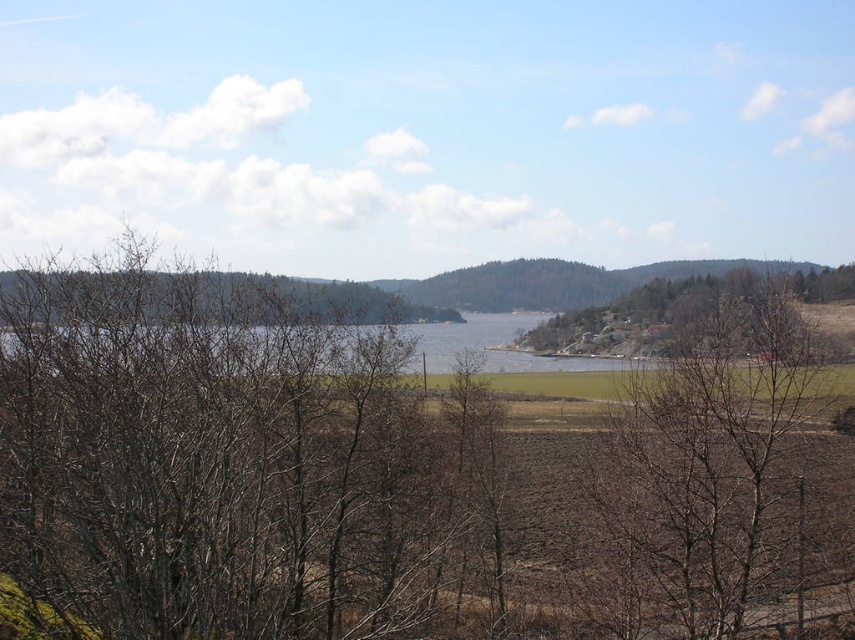
Question: Which object is the farthest from the brown bare branches at center?

Choices:
 (A) brown leafless tree at center-right
 (B) brown leafless tree at right

Answer: (A)

Question: Is brown bare branches at center in front of brown leafless tree at right?

Choices:
 (A) no
 (B) yes

Answer: (B)

Question: Is brown bare branches at center wider than brown leafless tree at right?

Choices:
 (A) no
 (B) yes

Answer: (B)

Question: Among these objects, which one is nearest to the camera?

Choices:
 (A) brown bare branches at center
 (B) brown leafless tree at right
 (C) brown leafless tree at center-right

Answer: (A)

Question: Based on their relative distances, which object is nearer to the brown leafless tree at right?

Choices:
 (A) brown leafless tree at center-right
 (B) brown bare branches at center

Answer: (A)

Question: Can you confirm if brown bare branches at center is positioned below brown leafless tree at center-right?

Choices:
 (A) yes
 (B) no

Answer: (A)